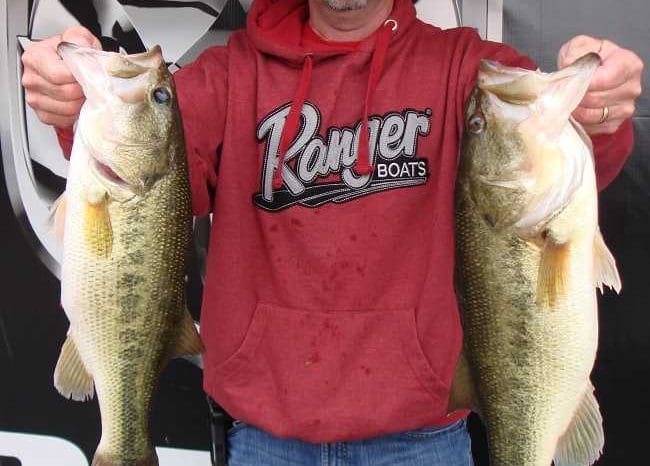
Locate an element on the screen. This screenshot has width=650, height=466. lace is located at coordinates (367, 124).